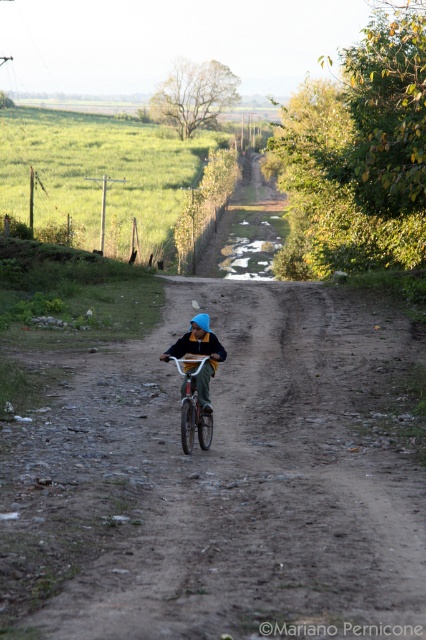
Which is behind, point (164, 353) or point (178, 369)?

Point (164, 353)

Who is positioned more to the right, blue fabric helmet at center or white matte bicycle at center?

From the viewer's perspective, white matte bicycle at center appears more on the right side.

Find the location of a particular element. blue fabric helmet at center is located at coordinates (201, 355).